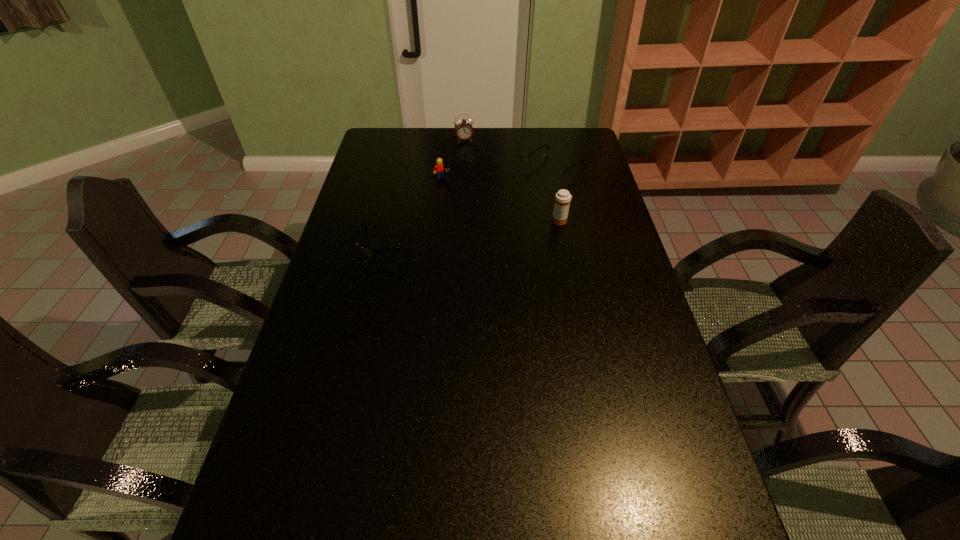
This screenshot has height=540, width=960. I want to click on vacant spot on the desktop that is between the left spectacles and the medicine and is positioned at the hinge ends of the right spectacles, so click(x=465, y=232).

Locate an element on the screen. This screenshot has width=960, height=540. free space on the desktop that is between the nearer spectacles and the medicine and is positioned on the front-facing side of the Lego is located at coordinates (476, 231).

Identify the location of vacant space on the desktop that is between the shortest object and the medicine and is positioned on the clock face of the farthest object. (492, 229).